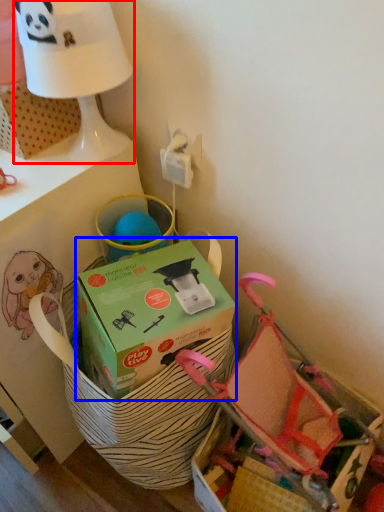
Question: Which object is closer to the camera taking this photo, table lamp (highlighted by a red box) or box (highlighted by a blue box)?

Choices:
 (A) table lamp
 (B) box

Answer: (B)